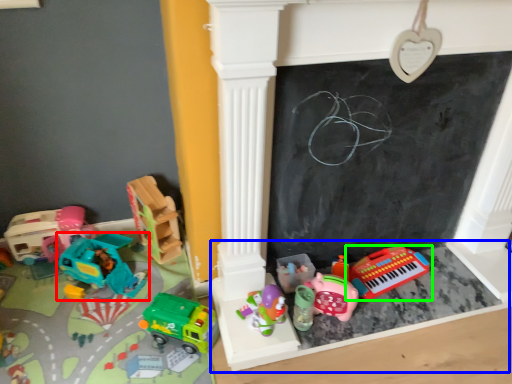
Question: Which object is the farthest from toy (highlighted by a red box)? Choose among these: furniture (highlighted by a blue box) or toy (highlighted by a green box).

Choices:
 (A) furniture
 (B) toy

Answer: (B)